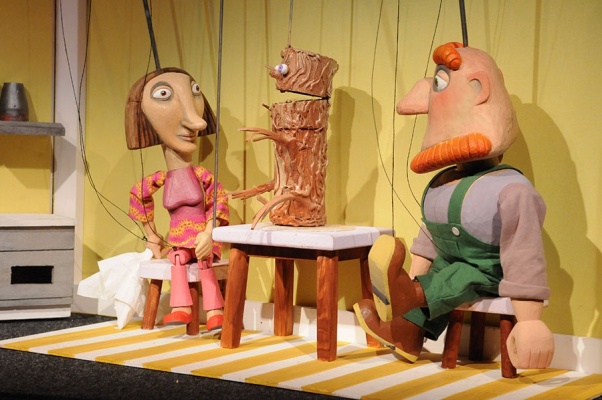
Identify the location of round stool top. The image size is (602, 400). pyautogui.click(x=160, y=265), pyautogui.click(x=498, y=303).